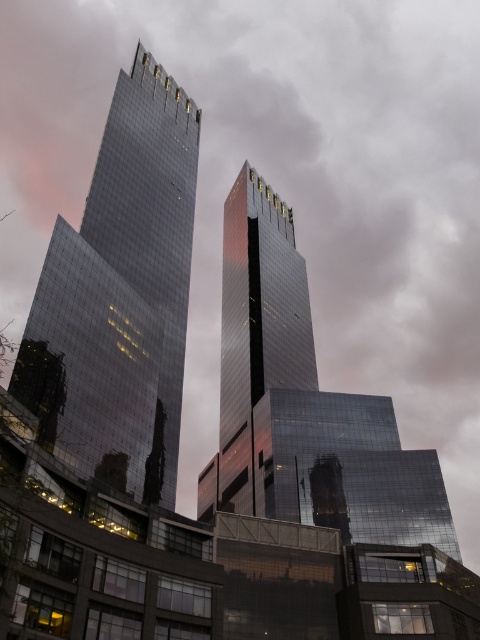
Question: Is shiny glass tower at center thinner than shiny glass skyscraper at center?

Choices:
 (A) yes
 (B) no

Answer: (A)

Question: Which of the following is the closest to the observer?

Choices:
 (A) shiny glass skyscraper at center
 (B) shiny glass tower at center

Answer: (B)

Question: Does shiny glass tower at center appear on the right side of shiny glass skyscraper at center?

Choices:
 (A) no
 (B) yes

Answer: (A)

Question: Is shiny glass tower at center to the left of shiny glass skyscraper at center from the viewer's perspective?

Choices:
 (A) no
 (B) yes

Answer: (B)

Question: Which object is farther from the camera taking this photo?

Choices:
 (A) shiny glass skyscraper at center
 (B) shiny glass tower at center

Answer: (A)

Question: Among these objects, which one is farthest from the camera?

Choices:
 (A) shiny glass tower at center
 (B) shiny glass skyscraper at center

Answer: (B)